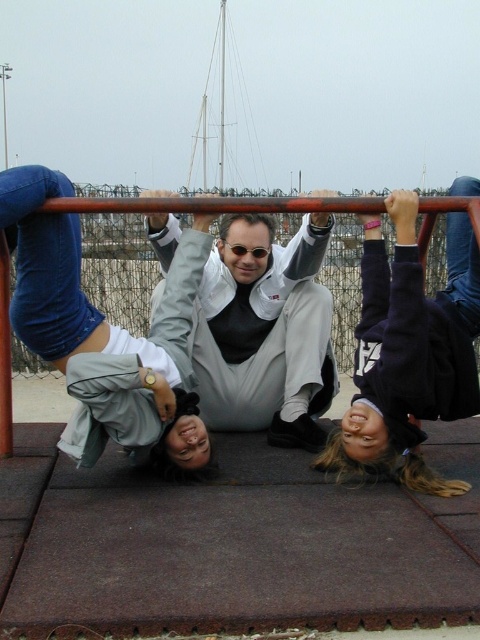
Question: Is dark blue sweater at center smaller than white matte jacket at center?

Choices:
 (A) yes
 (B) no

Answer: (A)

Question: Does dark blue sweater at center appear on the left side of white matte jacket at center?

Choices:
 (A) yes
 (B) no

Answer: (B)

Question: Among these objects, which one is farthest from the camera?

Choices:
 (A) white matte jacket at center
 (B) dark blue sweater at center

Answer: (A)

Question: Where is dark blue sweater at center located in relation to white matte jacket at center in the image?

Choices:
 (A) below
 (B) above

Answer: (A)